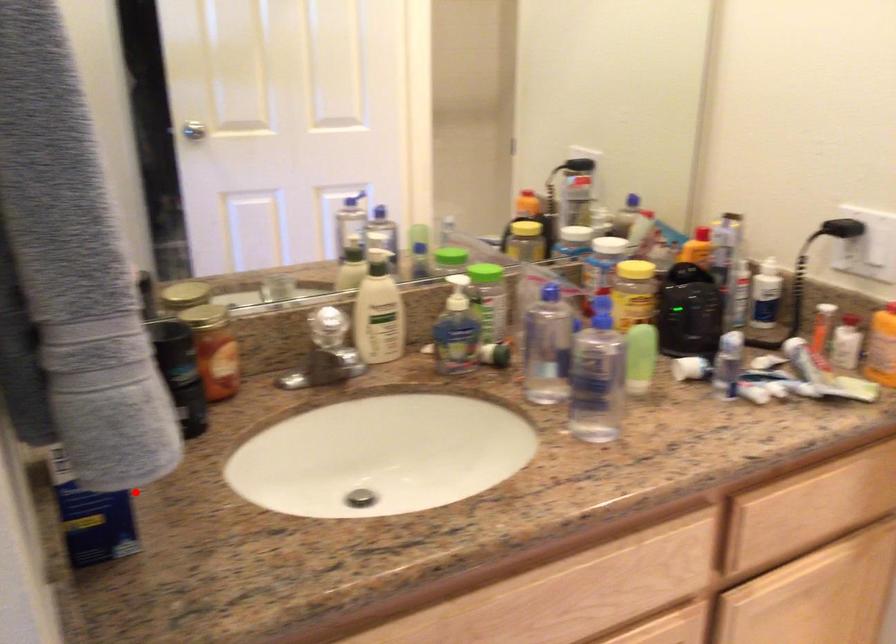
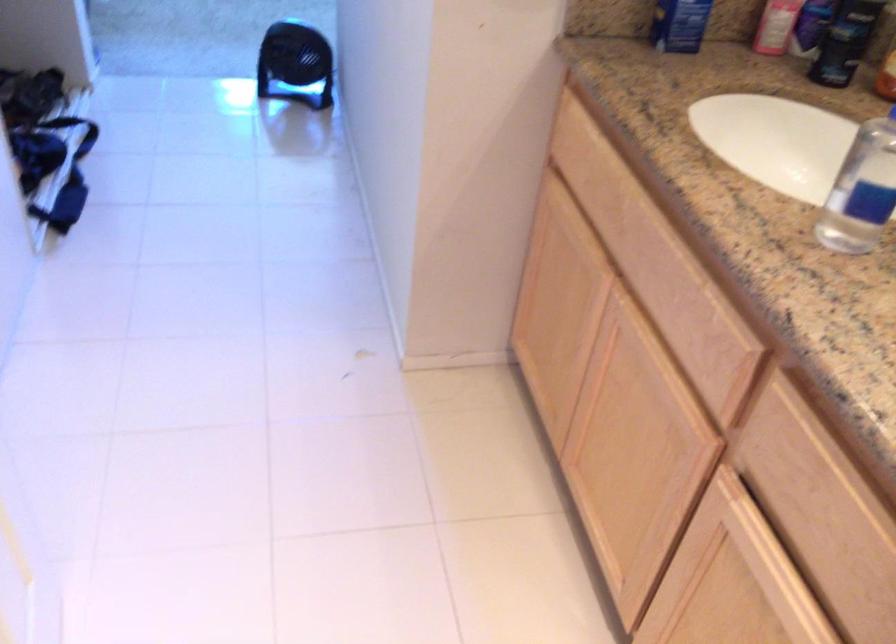
Question: A red point is marked in image1. In image2, is the corresponding 3D point closer to the camera or farther? Reply with the corresponding letter.

Choices:
 (A) The corresponding 3D point is closer.
 (B) The corresponding 3D point is farther.

Answer: (B)